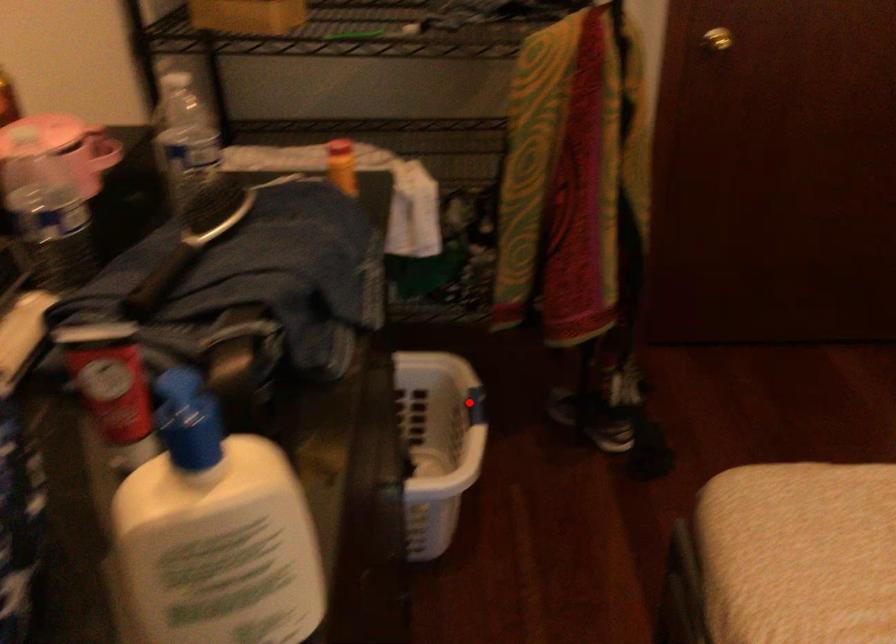
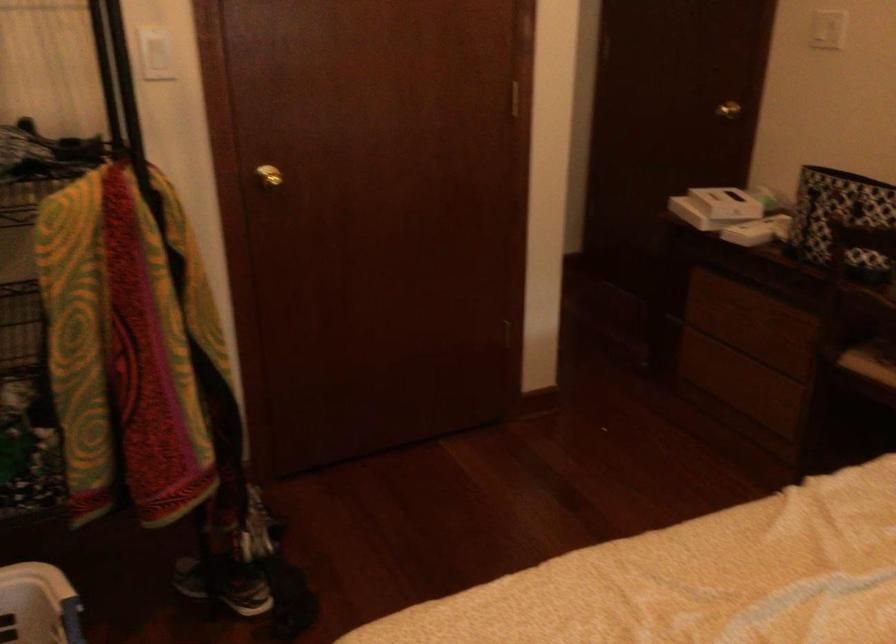
Question: I am providing you with two images of the same scene from different viewpoints. Image1 has a red point marked. In image2, the corresponding 3D location appears at what relative position? Reply with the corresponding letter.

Choices:
 (A) Closer
 (B) Farther

Answer: (A)